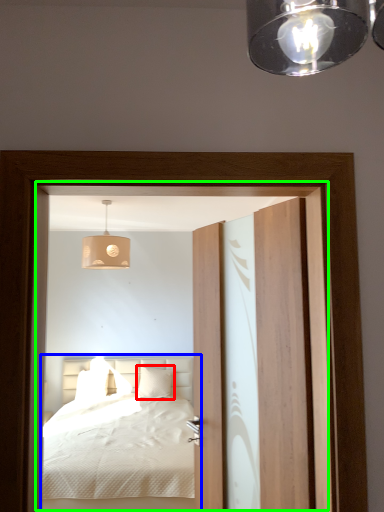
Question: Based on their relative distances, which object is nearer to pillow (highlighted by a red box)? Choose from bed (highlighted by a blue box) and screen door (highlighted by a green box).

Choices:
 (A) bed
 (B) screen door

Answer: (A)